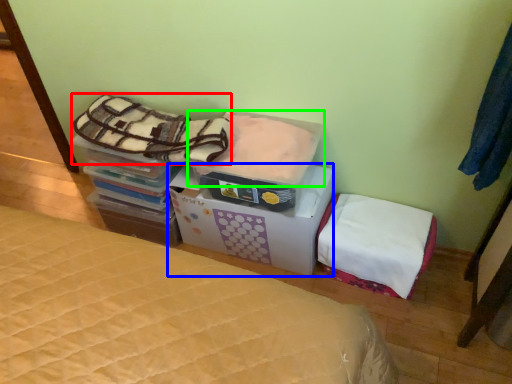
Question: Which is farther away from blanket (highlighted by a red box)? cardboard box (highlighted by a blue box) or blanket (highlighted by a green box)?

Choices:
 (A) cardboard box
 (B) blanket

Answer: (A)